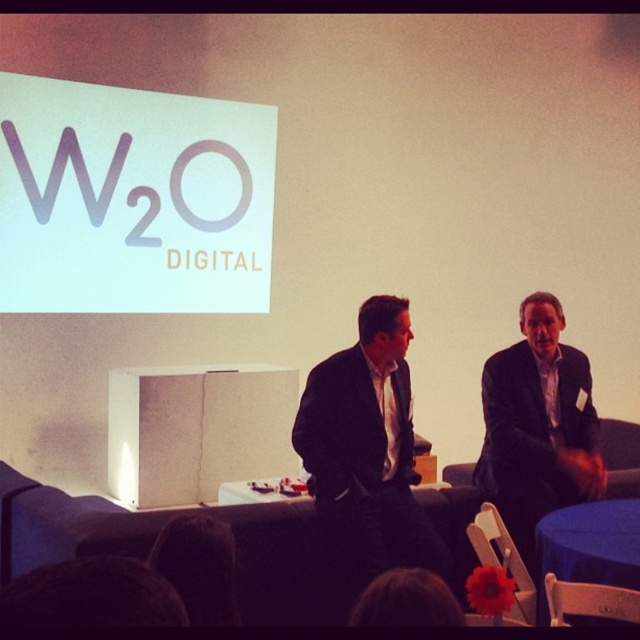
You are an event planner organizing a virtual conference. You need to ensure that all participants can clearly see the presenter on the stage. Given the setup described, will the presenter in the black suit at center be visible to the audience without obstruction from the white paper at upper left?

The black suit at center is behind the white paper at upper left, so the presenter in the black suit at center will be obscured by the white paper at upper left and may not be fully visible to the audience.